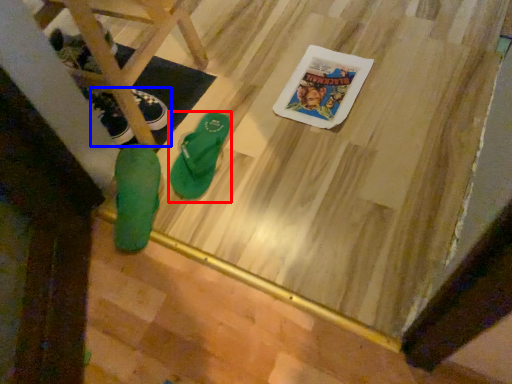
Question: Which object appears farthest to the camera in this image, footwear (highlighted by a red box) or footwear (highlighted by a blue box)?

Choices:
 (A) footwear
 (B) footwear

Answer: (B)